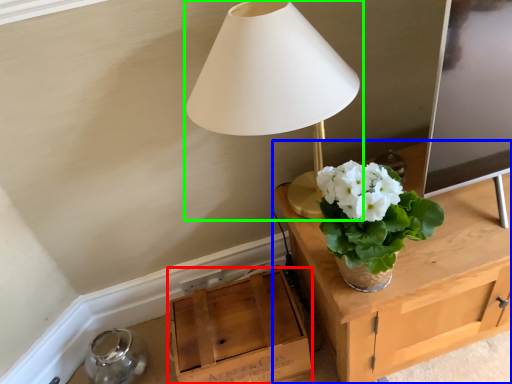
Question: Considering the real-world distances, which object is farthest from cardboard box (highlighted by a red box)? table (highlighted by a blue box) or lamp (highlighted by a green box)?

Choices:
 (A) table
 (B) lamp

Answer: (B)